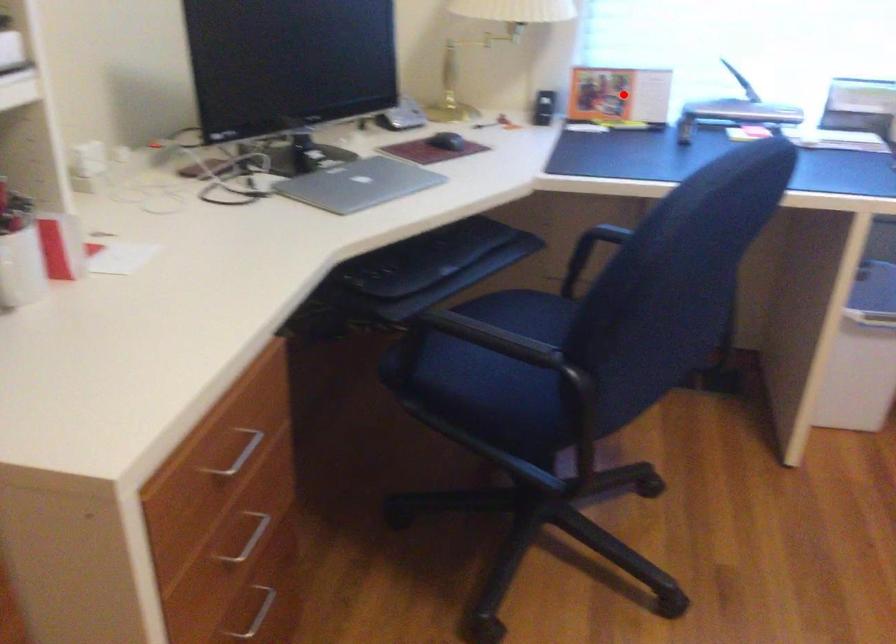
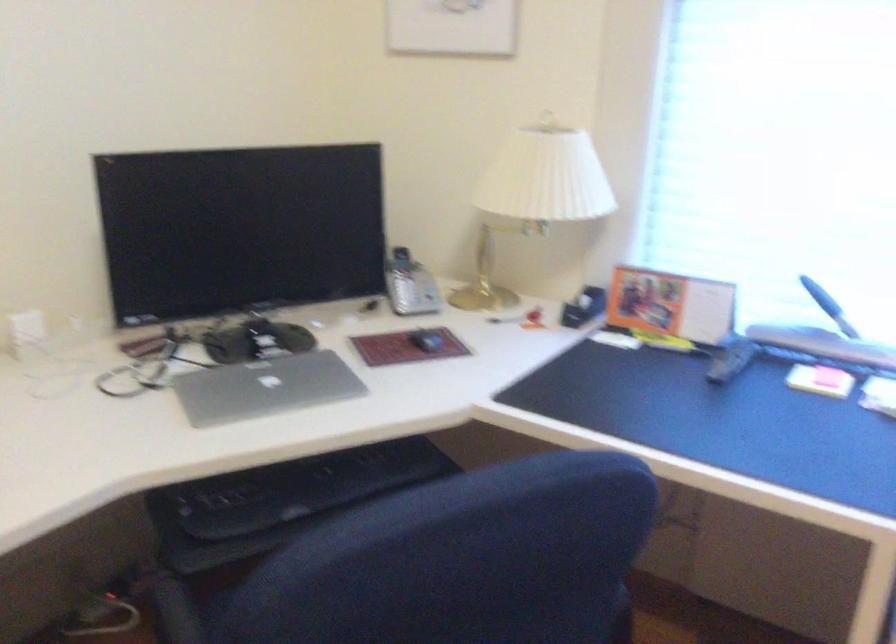
Question: I am providing you with two images of the same scene from different viewpoints. A red point is shown in image1. For the corresponding object point in image2, is it positioned nearer or farther from the camera?

Choices:
 (A) Nearer
 (B) Farther

Answer: (A)